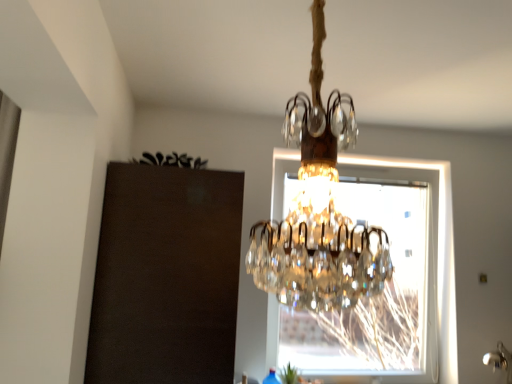
Question: Is point (285, 374) positioned closer to the camera than point (451, 193)?

Choices:
 (A) closer
 (B) farther

Answer: (A)

Question: From the image's perspective, is green leafy plant at lower center above or below transparent glass window at center?

Choices:
 (A) above
 (B) below

Answer: (B)

Question: Looking at the image, does green leafy plant at lower center seem bigger or smaller compared to transparent glass window at center?

Choices:
 (A) small
 (B) big

Answer: (A)

Question: Based on their sizes in the image, would you say transparent glass window at center is bigger or smaller than green leafy plant at lower center?

Choices:
 (A) big
 (B) small

Answer: (A)

Question: From the image's perspective, is transparent glass window at center located above or below green leafy plant at lower center?

Choices:
 (A) below
 (B) above

Answer: (B)

Question: In terms of width, does transparent glass window at center look wider or thinner when compared to green leafy plant at lower center?

Choices:
 (A) thin
 (B) wide

Answer: (B)

Question: Considering the positions of point (437, 162) and point (282, 372), is point (437, 162) closer or farther from the camera than point (282, 372)?

Choices:
 (A) farther
 (B) closer

Answer: (A)